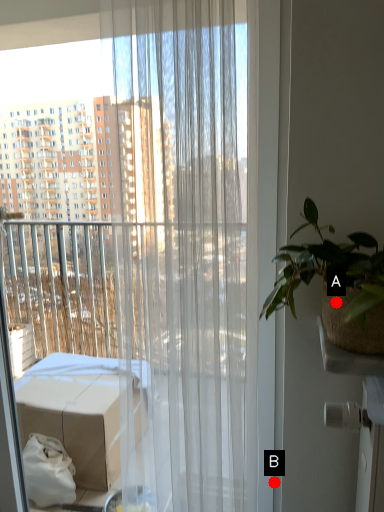
Question: Two points are circled on the image, labeled by A and B beside each circle. Which point appears closest to the camera in this image?

Choices:
 (A) A is closer
 (B) B is closer

Answer: (A)